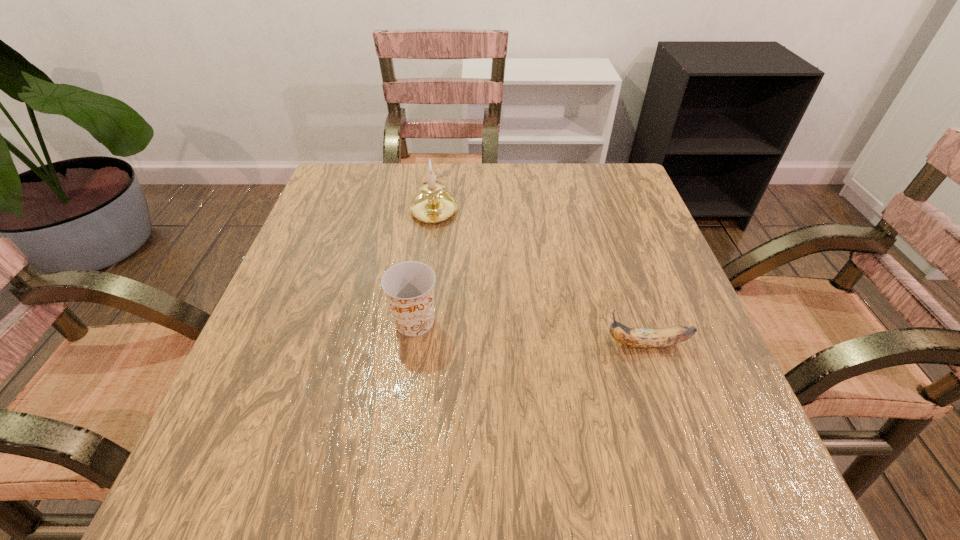
This screenshot has width=960, height=540. Identify the location of the farthest object. (433, 204).

The width and height of the screenshot is (960, 540). Find the location of `the tallest object`. the tallest object is located at coordinates (433, 204).

Locate an element on the screen. The image size is (960, 540). Dixie cup is located at coordinates 409,286.

Identify the location of the shortest object. (638, 338).

Where is `the rightmost object`? the rightmost object is located at coordinates tap(638, 338).

Image resolution: width=960 pixels, height=540 pixels. Find the location of `vacant space situated 0.120m on the handle side of the farthest object`. vacant space situated 0.120m on the handle side of the farthest object is located at coordinates 440,165.

Identify the location of free space located on the handle side of the farthest object. The height and width of the screenshot is (540, 960). (439, 175).

Where is `vacant area located on the right of the Dixie cup`? The height and width of the screenshot is (540, 960). vacant area located on the right of the Dixie cup is located at coordinates (581, 322).

Find the location of a particular element. free space located on the peel of the shortest object is located at coordinates (551, 345).

The height and width of the screenshot is (540, 960). What are the coordinates of `vacant space located 0.170m on the peel of the shortest object` in the screenshot? It's located at (506, 345).